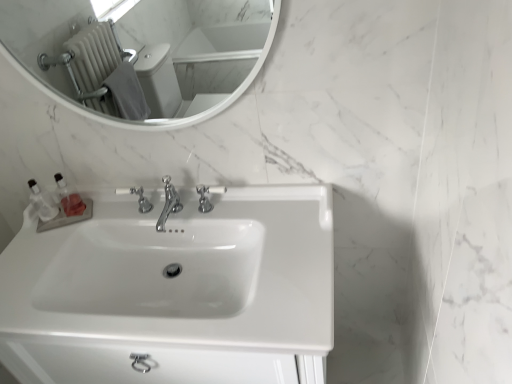
Find the location of a particular element. The image size is (512, 384). vacant point to the right of clear plastic bottles at left, which is the second toiletry from left to right is located at coordinates (111, 206).